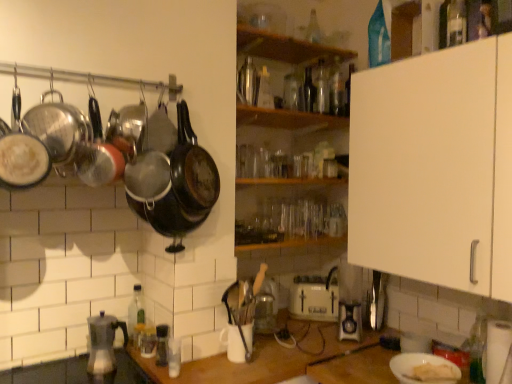
At what (x,y) coordinates should I click in order to perform the action: click on vacant area that lies in front of transparent glass bottle at upper center, marked as the ninth bottle in a front-to-back arrangement. Please return your answer as a coordinate pair (x, y). This screenshot has width=512, height=384. Looking at the image, I should click on (308, 48).